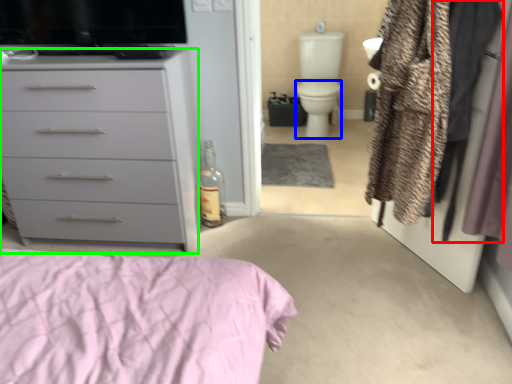
Question: Which is farther away from clothing (highlighted by a red box)? toilet bowl (highlighted by a blue box) or chest of drawers (highlighted by a green box)?

Choices:
 (A) toilet bowl
 (B) chest of drawers

Answer: (A)